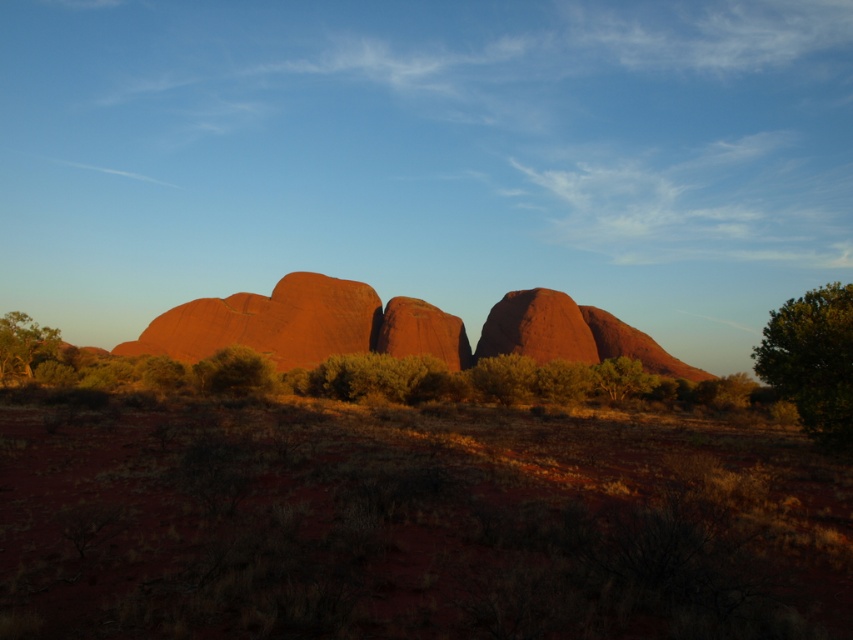
Question: In this image, where is dried grass at center located relative to green leafy tree at right?

Choices:
 (A) left
 (B) right

Answer: (A)

Question: Considering the real-world distances, which object is closest to the rustic sandstone rock formation at center?

Choices:
 (A) green leafy tree at right
 (B) green leafy shrub at lower left

Answer: (B)

Question: Among these points, which one is nearest to the camera?

Choices:
 (A) (293, 276)
 (B) (767, 356)
 (C) (25, 317)
 (D) (434, 445)

Answer: (D)

Question: Considering the relative positions of rustic sandstone rock formation at center and green leafy shrub at lower left in the image provided, where is rustic sandstone rock formation at center located with respect to green leafy shrub at lower left?

Choices:
 (A) below
 (B) above

Answer: (B)

Question: Is rustic sandstone rock formation at center thinner than green leafy shrub at lower left?

Choices:
 (A) no
 (B) yes

Answer: (A)

Question: Which object appears closest to the camera in this image?

Choices:
 (A) green leafy shrub at lower left
 (B) dried grass at center

Answer: (B)